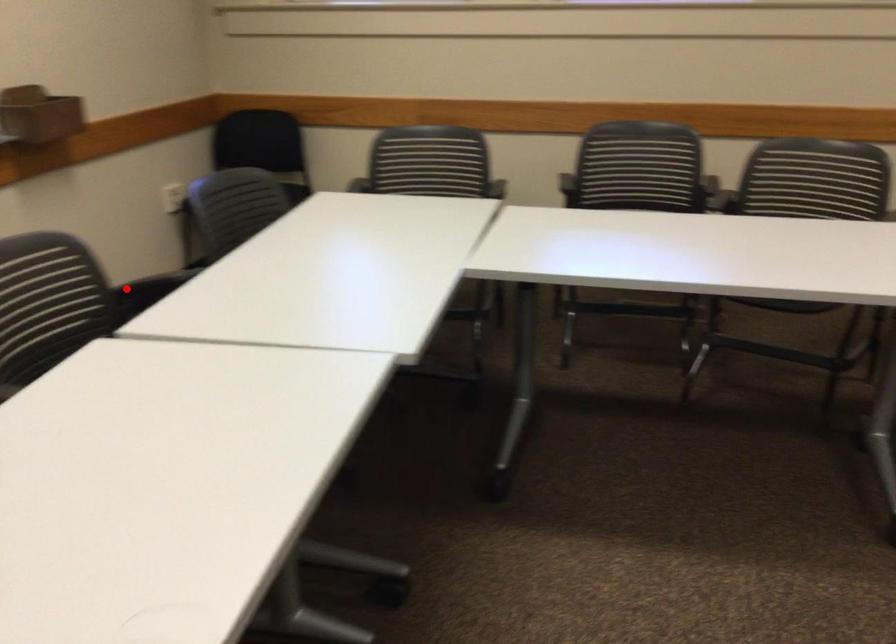
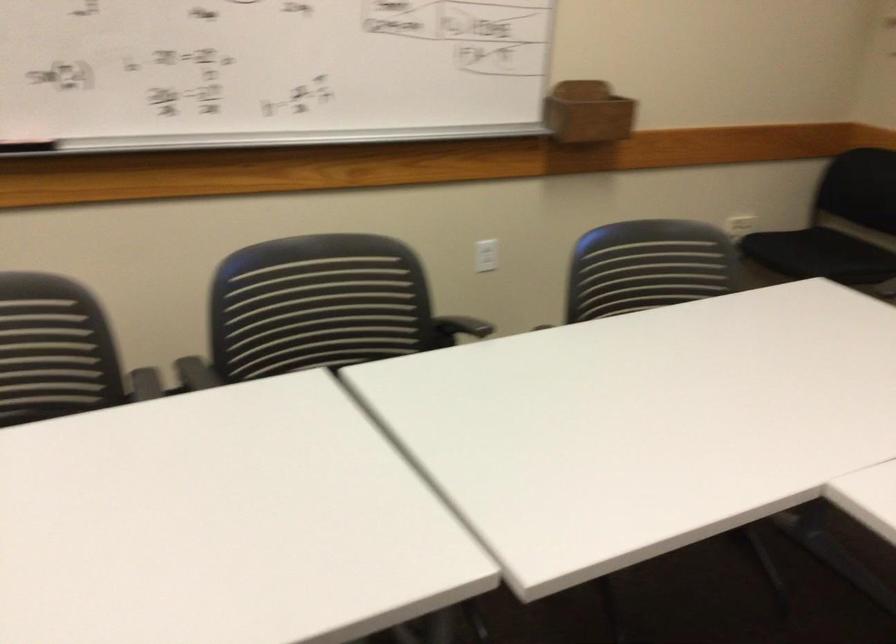
Locate, in the second image, the point that corresponds to the highlighted location in the first image.

(458, 328)